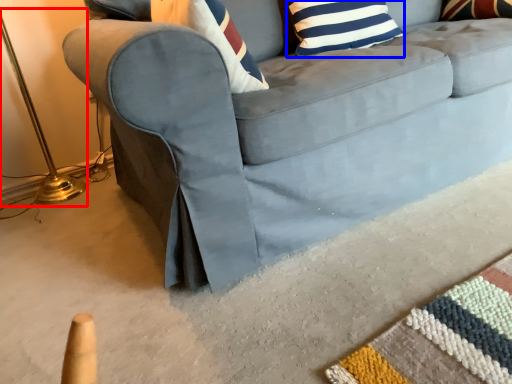
Question: Which point is closer to the camera, table lamp (highlighted by a red box) or pillow (highlighted by a blue box)?

Choices:
 (A) table lamp
 (B) pillow

Answer: (A)